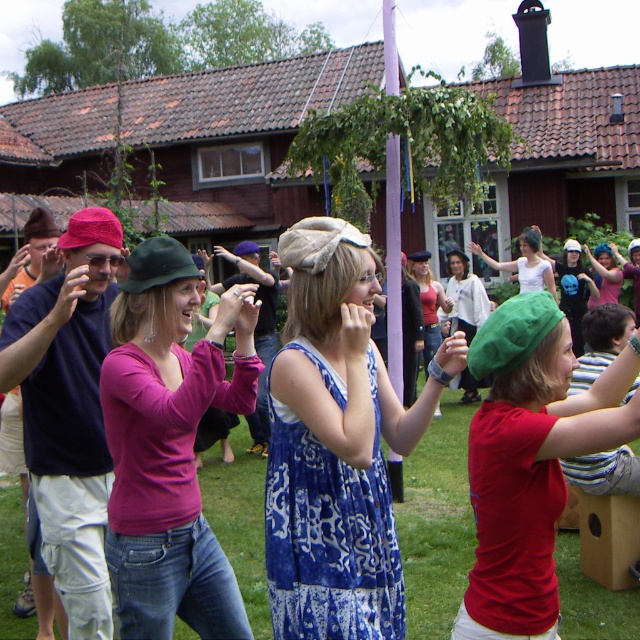
You are a photographer at the event and want to place a decorative flag exactly at the center of the matte green beret at center. What are the coordinates where you should place the flag?

The coordinates for the center of the matte green beret at center are at point (531,460), so you should place the flag there.